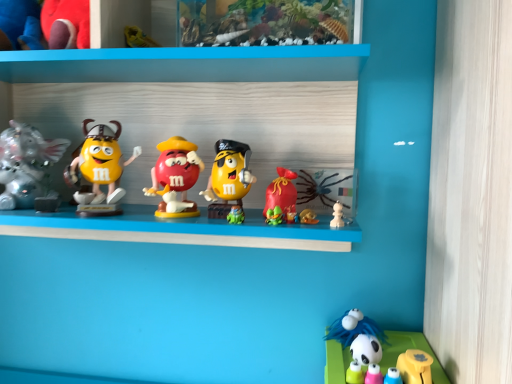
Where is `silver metallic elephant at left, the 2th toy when ordered from left to right`? The height and width of the screenshot is (384, 512). silver metallic elephant at left, the 2th toy when ordered from left to right is located at coordinates (26, 165).

I want to click on white glossy panda at lower right, so click(x=410, y=348).

Locate an element on the screen. Image resolution: width=512 pixels, height=384 pixels. matte plastic m&m figure at center, the fourth toy when ordered from left to right is located at coordinates (175, 176).

Image resolution: width=512 pixels, height=384 pixels. Describe the element at coordinates (362, 357) in the screenshot. I see `white matte panda at lower right, which is counted as the second toy, starting from the right` at that location.

In order to face yellow plastic toy at lower right, which appears as the seventh toy when viewed from the left, should I rotate leftwards or rightwards?

Rotate your view right by about 20.552°.

This screenshot has width=512, height=384. I want to click on silver metallic elephant at left, which is the 6th toy from right to left, so 26,165.

What's the angular difference between silver metallic elephant at left, the 2th toy when ordered from left to right, and white matte panda at lower right, which is counted as the second toy, starting from the right,'s facing directions?

They differ by 1.19 degrees in their facing directions.

Between silver metallic elephant at left, which is the 6th toy from right to left, and white matte panda at lower right, which is counted as the second toy, starting from the right, which one has more height?

silver metallic elephant at left, which is the 6th toy from right to left, is taller.

From a real-world perspective, which is physically above, silver metallic elephant at left, the 2th toy when ordered from left to right, or white matte panda at lower right, the 6th toy positioned from the left?

silver metallic elephant at left, the 2th toy when ordered from left to right, from a real-world perspective.

Find the location of a particular element. toy that is the 4th one when counting forward from the silver metallic elephant at left, which is the 6th toy from right to left is located at coordinates (362, 357).

Which is behind, point (71, 47) or point (19, 164)?

The point (19, 164) is behind.

Measure the distance between velvet plush toy at upper left, which is counted as the seventh toy, starting from the right, and silver metallic elephant at left, the 2th toy when ordered from left to right.

velvet plush toy at upper left, which is counted as the seventh toy, starting from the right, and silver metallic elephant at left, the 2th toy when ordered from left to right, are 7.76 inches apart from each other.

Does velvet plush toy at upper left, which is counted as the seventh toy, starting from the right, come in front of silver metallic elephant at left, which is the 6th toy from right to left?

Yes, velvet plush toy at upper left, which is counted as the seventh toy, starting from the right, is closer to the camera.

Are velvet plush toy at upper left, which appears as the 1th toy when viewed from the left, and silver metallic elephant at left, which is the 6th toy from right to left, beside each other?

No, velvet plush toy at upper left, which appears as the 1th toy when viewed from the left, is not with silver metallic elephant at left, which is the 6th toy from right to left.

Is yellow plastic toy at lower right, which appears as the 1th toy when viewed from the right, bigger or smaller than matte yellow figurine at left, acting as the third toy starting from the left?

Considering their sizes, yellow plastic toy at lower right, which appears as the 1th toy when viewed from the right, takes up less space than matte yellow figurine at left, acting as the third toy starting from the left.

From a real-world perspective, which object rests below the other?

From a 3D spatial view, yellow plastic toy at lower right, which appears as the 1th toy when viewed from the right, is below.

From the image's perspective, would you say yellow plastic toy at lower right, which appears as the 1th toy when viewed from the right, is positioned over matte yellow figurine at left, acting as the third toy starting from the left?

No.

In the scene shown: Between matte plastic m&m figure at center, the fourth toy when ordered from left to right, and matte yellow plastic m&m at center, the 5th toy viewed from the left, which one has more height?

With more height is matte plastic m&m figure at center, the fourth toy when ordered from left to right.

From the image's perspective, between matte plastic m&m figure at center, arranged as the 4th toy when viewed from the right, and matte yellow plastic m&m at center, the 3th toy when ordered from right to left, which one is located above?

matte plastic m&m figure at center, arranged as the 4th toy when viewed from the right.

Considering the relative positions of matte plastic m&m figure at center, arranged as the 4th toy when viewed from the right, and matte yellow plastic m&m at center, the 3th toy when ordered from right to left, in the image provided, is matte plastic m&m figure at center, arranged as the 4th toy when viewed from the right, to the left of matte yellow plastic m&m at center, the 3th toy when ordered from right to left, from the viewer's perspective?

Answer: Yes, matte plastic m&m figure at center, arranged as the 4th toy when viewed from the right, is to the left of matte yellow plastic m&m at center, the 3th toy when ordered from right to left.

In the scene shown: From a real-world perspective, is matte plastic m&m figure at center, arranged as the 4th toy when viewed from the right, beneath matte yellow plastic m&m at center, the 3th toy when ordered from right to left?

No, from a real-world perspective, matte plastic m&m figure at center, arranged as the 4th toy when viewed from the right, is not beneath matte yellow plastic m&m at center, the 3th toy when ordered from right to left.

Can you tell me how much yellow plastic toy at lower right, which appears as the seventh toy when viewed from the left, and white matte panda at lower right, which is counted as the second toy, starting from the right, differ in facing direction?

The angular difference between yellow plastic toy at lower right, which appears as the seventh toy when viewed from the left, and white matte panda at lower right, which is counted as the second toy, starting from the right, is 1.35 degrees.

There is a yellow plastic toy at lower right, which appears as the 1th toy when viewed from the right. At what (x,y) coordinates should I click in order to perform the action: click on the 1st toy above it (from the image's perspective). Please return your answer as a coordinate pair (x, y). Looking at the image, I should click on (362, 357).

Is yellow plastic toy at lower right, which appears as the 1th toy when viewed from the right, positioned far away from white matte panda at lower right, the 6th toy positioned from the left?

No, yellow plastic toy at lower right, which appears as the 1th toy when viewed from the right, is in close proximity to white matte panda at lower right, the 6th toy positioned from the left.

In the scene shown: Can you confirm if yellow plastic toy at lower right, which appears as the 1th toy when viewed from the right, is taller than matte yellow plastic m&m at center, the 3th toy when ordered from right to left?

In fact, yellow plastic toy at lower right, which appears as the 1th toy when viewed from the right, may be shorter than matte yellow plastic m&m at center, the 3th toy when ordered from right to left.

Which object is thinner, yellow plastic toy at lower right, which appears as the seventh toy when viewed from the left, or matte yellow plastic m&m at center, the 3th toy when ordered from right to left?

Thinner between the two is yellow plastic toy at lower right, which appears as the seventh toy when viewed from the left.

From the image's perspective, which is below, yellow plastic toy at lower right, which appears as the 1th toy when viewed from the right, or matte yellow plastic m&m at center, the 5th toy viewed from the left?

From the image's view, yellow plastic toy at lower right, which appears as the 1th toy when viewed from the right, is below.

Can you tell me how much yellow plastic toy at lower right, which appears as the 1th toy when viewed from the right, and matte yellow plastic m&m at center, the 5th toy viewed from the left, differ in facing direction?

The facing directions of yellow plastic toy at lower right, which appears as the 1th toy when viewed from the right, and matte yellow plastic m&m at center, the 5th toy viewed from the left, are 2.55 degrees apart.

From a real-world perspective, is silver metallic elephant at left, the 2th toy when ordered from left to right, above or below matte plastic m&m figure at center, the fourth toy when ordered from left to right?

From a real-world perspective, silver metallic elephant at left, the 2th toy when ordered from left to right, is physically above matte plastic m&m figure at center, the fourth toy when ordered from left to right.

From a real-world perspective, count 1st toys downward from the silver metallic elephant at left, the 2th toy when ordered from left to right, and point to it. Please provide its 2D coordinates.

[(175, 176)]

Is silver metallic elephant at left, which is the 6th toy from right to left, in front of or behind matte plastic m&m figure at center, arranged as the 4th toy when viewed from the right, in the image?

In the image, silver metallic elephant at left, which is the 6th toy from right to left, appears behind matte plastic m&m figure at center, arranged as the 4th toy when viewed from the right.

Does point (10, 197) come closer to viewer compared to point (159, 207)?

That is False.

Starting from the silver metallic elephant at left, which is the 6th toy from right to left, which toy is the 4th one in front? Please provide its 2D coordinates.

[(362, 357)]

The image size is (512, 384). Identify the location of toy located on the left of silver metallic elephant at left, the 2th toy when ordered from left to right. (44, 24).

Looking at the image, which one is located further to matte yellow figurine at left, the 5th toy positioned from the right, matte yellow plastic m&m at center, the 3th toy when ordered from right to left, or velvet plush toy at upper left, which appears as the 1th toy when viewed from the left?

velvet plush toy at upper left, which appears as the 1th toy when viewed from the left.

Based on their spatial positions, is matte yellow plastic m&m at center, the 3th toy when ordered from right to left, or matte yellow figurine at left, acting as the third toy starting from the left, further from velvet plush toy at upper left, which appears as the 1th toy when viewed from the left?

matte yellow plastic m&m at center, the 3th toy when ordered from right to left, lies further to velvet plush toy at upper left, which appears as the 1th toy when viewed from the left, than the other object.

Considering their positions, is white matte panda at lower right, which is counted as the second toy, starting from the right, positioned further to matte yellow plastic m&m at center, the 3th toy when ordered from right to left, than yellow plastic toy at lower right, which appears as the 1th toy when viewed from the right?

yellow plastic toy at lower right, which appears as the 1th toy when viewed from the right, is positioned further to the anchor matte yellow plastic m&m at center, the 3th toy when ordered from right to left.

Based on the photo, when comparing their distances from matte yellow plastic m&m at center, the 3th toy when ordered from right to left, does matte plastic m&m figure at center, the fourth toy when ordered from left to right, or yellow plastic toy at lower right, which appears as the 1th toy when viewed from the right, seem closer?

Among the two, matte plastic m&m figure at center, the fourth toy when ordered from left to right, is located nearer to matte yellow plastic m&m at center, the 3th toy when ordered from right to left.

Looking at the image, which one is located closer to velvet plush toy at upper left, which appears as the 1th toy when viewed from the left, white glossy panda at lower right or matte yellow figurine at left, the 5th toy positioned from the right?

matte yellow figurine at left, the 5th toy positioned from the right, is positioned closer to the anchor velvet plush toy at upper left, which appears as the 1th toy when viewed from the left.

Based on the photo, which object lies further to the anchor point matte yellow plastic m&m at center, the 3th toy when ordered from right to left, matte yellow figurine at left, acting as the third toy starting from the left, or white matte panda at lower right, which is counted as the second toy, starting from the right?

The object further to matte yellow plastic m&m at center, the 3th toy when ordered from right to left, is white matte panda at lower right, which is counted as the second toy, starting from the right.

Based on their spatial positions, is matte plastic m&m figure at center, arranged as the 4th toy when viewed from the right, or yellow plastic toy at lower right, which appears as the 1th toy when viewed from the right, closer to velvet plush toy at upper left, which appears as the 1th toy when viewed from the left?

matte plastic m&m figure at center, arranged as the 4th toy when viewed from the right, lies closer to velvet plush toy at upper left, which appears as the 1th toy when viewed from the left, than the other object.

Estimate the real-world distances between objects in this image. Which object is closer to matte yellow figurine at left, acting as the third toy starting from the left, velvet plush toy at upper left, which appears as the 1th toy when viewed from the left, or white matte panda at lower right, the 6th toy positioned from the left?

velvet plush toy at upper left, which appears as the 1th toy when viewed from the left, lies closer to matte yellow figurine at left, acting as the third toy starting from the left, than the other object.

Where is `toy between velvet plush toy at upper left, which appears as the 1th toy when viewed from the left, and matte yellow figurine at left, the 5th toy positioned from the right, in the vertical direction`? This screenshot has width=512, height=384. toy between velvet plush toy at upper left, which appears as the 1th toy when viewed from the left, and matte yellow figurine at left, the 5th toy positioned from the right, in the vertical direction is located at coordinates (26, 165).

Locate an element on the screen. shelf between matte plastic m&m figure at center, the fourth toy when ordered from left to right, and yellow plastic toy at lower right, which appears as the 1th toy when viewed from the right, from left to right is located at coordinates [x=410, y=348].

Identify the location of toy that lies between white matte panda at lower right, the 6th toy positioned from the left, and white glossy panda at lower right from top to bottom. (415, 366).

Identify the location of toy located between silver metallic elephant at left, which is the 6th toy from right to left, and matte plastic m&m figure at center, arranged as the 4th toy when viewed from the right, in the left-right direction. (99, 163).